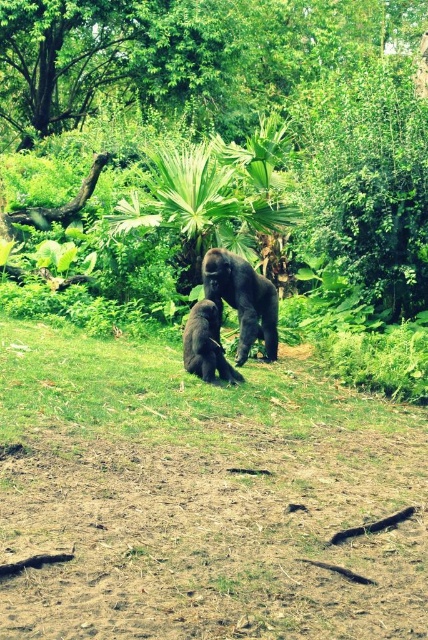
Which is more to the left, brown soil at center or shiny black gorilla at center?

Positioned to the left is shiny black gorilla at center.

In the scene shown: Is brown soil at center above shiny black gorilla at center?

No, brown soil at center is not above shiny black gorilla at center.

Is point (94, 538) more distant than point (192, 356)?

That is False.

The width and height of the screenshot is (428, 640). What are the coordinates of `brown soil at center` in the screenshot? It's located at (202, 499).

Between shiny dark brown gorilla at center and shiny black gorilla at center, which one appears on the right side from the viewer's perspective?

shiny dark brown gorilla at center

Which is above, shiny dark brown gorilla at center or shiny black gorilla at center?

shiny dark brown gorilla at center

Is point (244, 358) positioned after point (184, 340)?

That is True.

Find the location of a particular element. This screenshot has width=428, height=640. shiny dark brown gorilla at center is located at coordinates (243, 300).

Which is behind, point (309, 460) or point (246, 284)?

The point (246, 284) is more distant.

Is brown soil at center bigger than shiny dark brown gorilla at center?

Yes, brown soil at center is bigger than shiny dark brown gorilla at center.

Describe the element at coordinates (202, 499) in the screenshot. This screenshot has width=428, height=640. I see `brown soil at center` at that location.

At what (x,y) coordinates should I click in order to perform the action: click on brown soil at center. Please return your answer as a coordinate pair (x, y). Looking at the image, I should click on (202, 499).